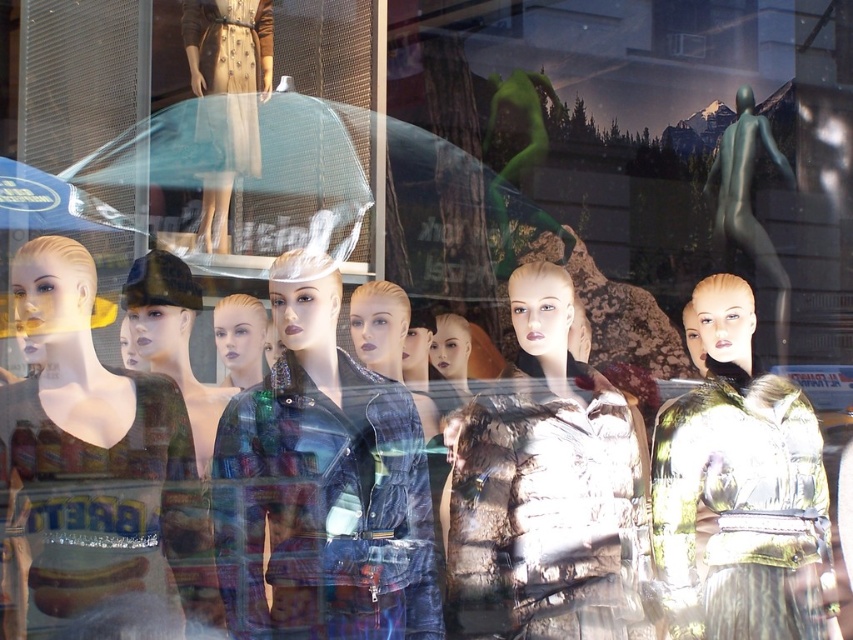
Question: In this image, where is matte black dress at left located relative to brown textured coat at center?

Choices:
 (A) above
 (B) below

Answer: (A)

Question: Is matte black dress at left above matte beige dress at center?

Choices:
 (A) no
 (B) yes

Answer: (A)

Question: Is metallic gold jacket at right smaller than matte beige dress at center?

Choices:
 (A) no
 (B) yes

Answer: (A)

Question: Which object is farther from the camera taking this photo?

Choices:
 (A) brown textured coat at center
 (B) matte black jacket at center
 (C) matte black dress at left

Answer: (B)

Question: Which of the following is the closest to the observer?

Choices:
 (A) (212, 92)
 (B) (281, 496)
 (C) (70, 504)
 (D) (718, 410)

Answer: (C)

Question: Which of the following is the farthest from the observer?

Choices:
 (A) plaid fabric jacket at center
 (B) matte black jacket at center
 (C) metallic gold jacket at right

Answer: (B)